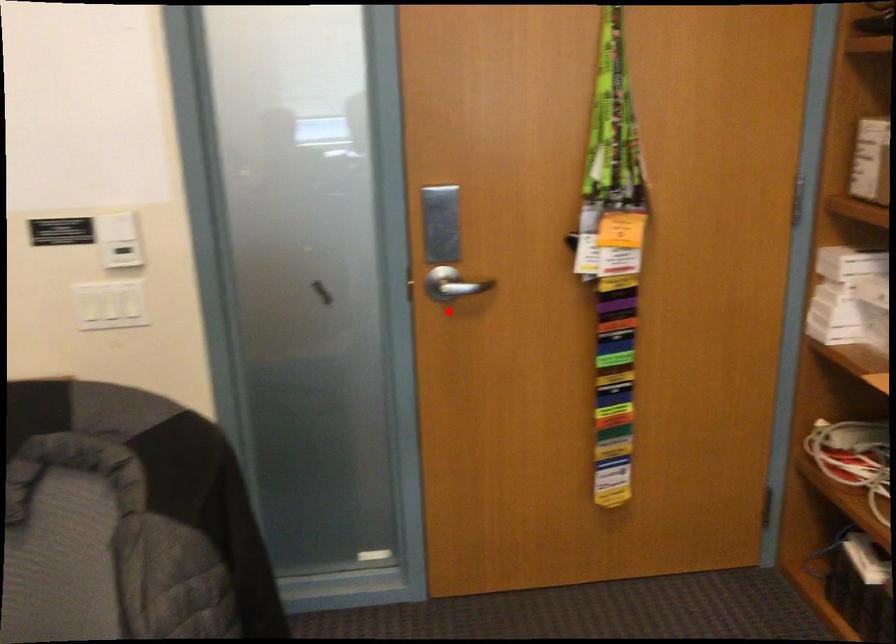
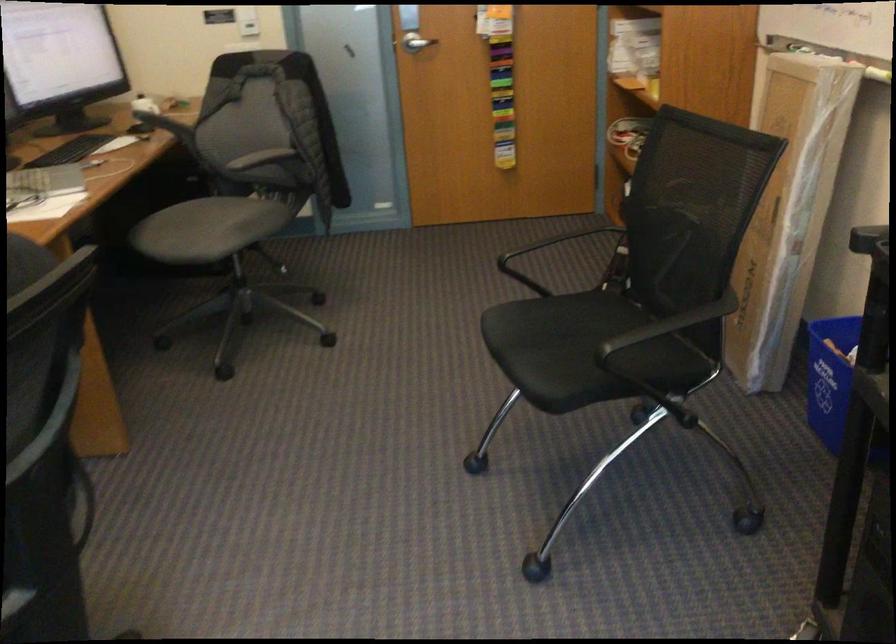
In the second image, find the point that corresponds to the highlighted location in the first image.

(415, 43)